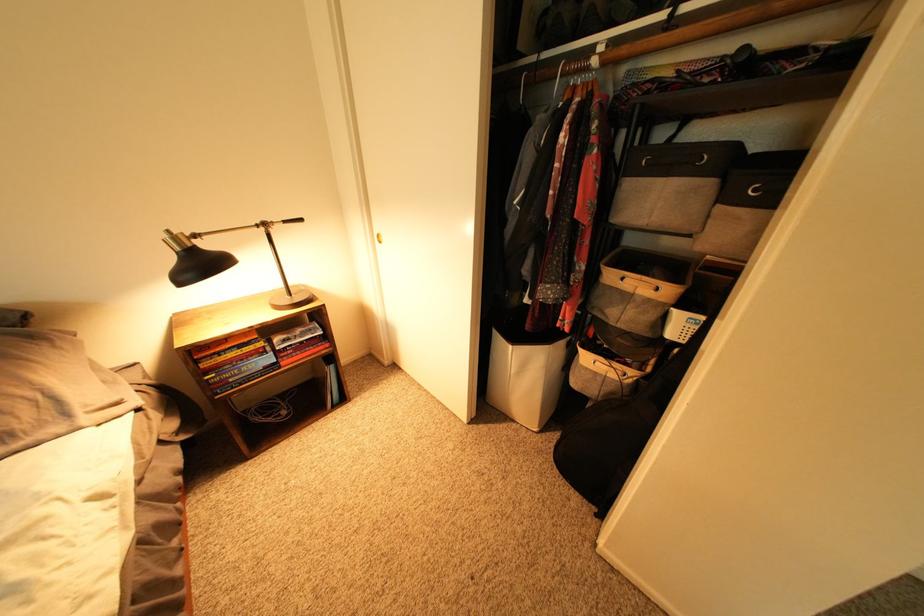
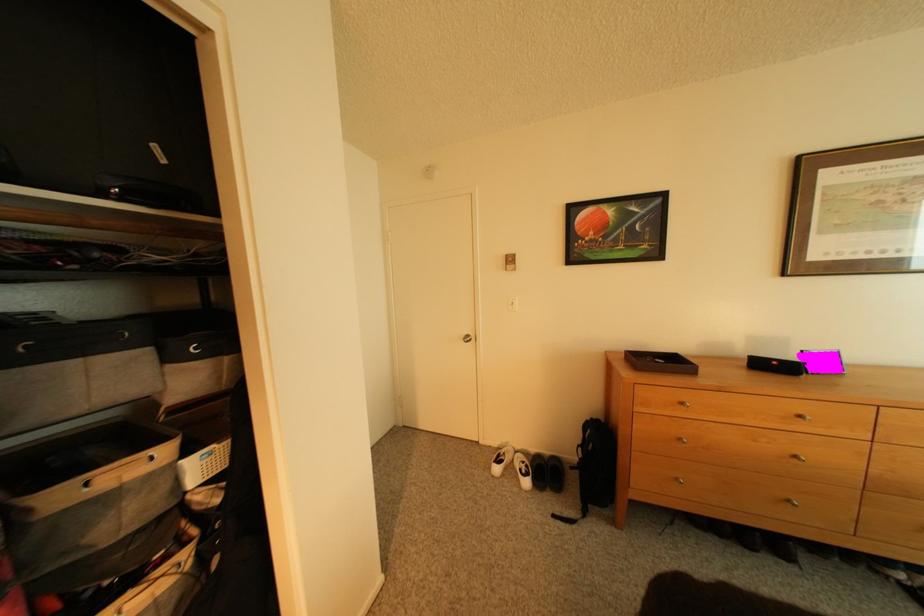
The images are taken continuously from a first-person perspective. In which direction is your viewpoint rotating?

The camera rotated toward right-down.